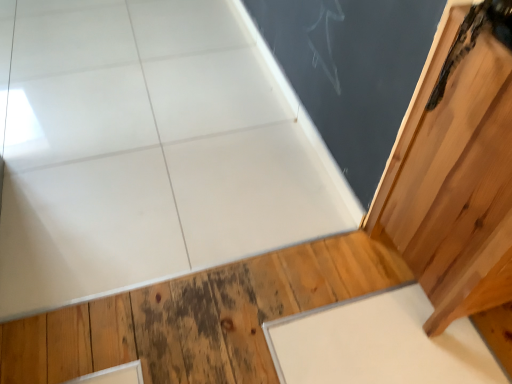
At what (x,y) coordinates should I click in order to perform the action: click on vacant point above natural wood floor at lower right (from a real-world perspective). Please return your answer as a coordinate pair (x, y). The image size is (512, 384). Looking at the image, I should click on pyautogui.click(x=246, y=325).